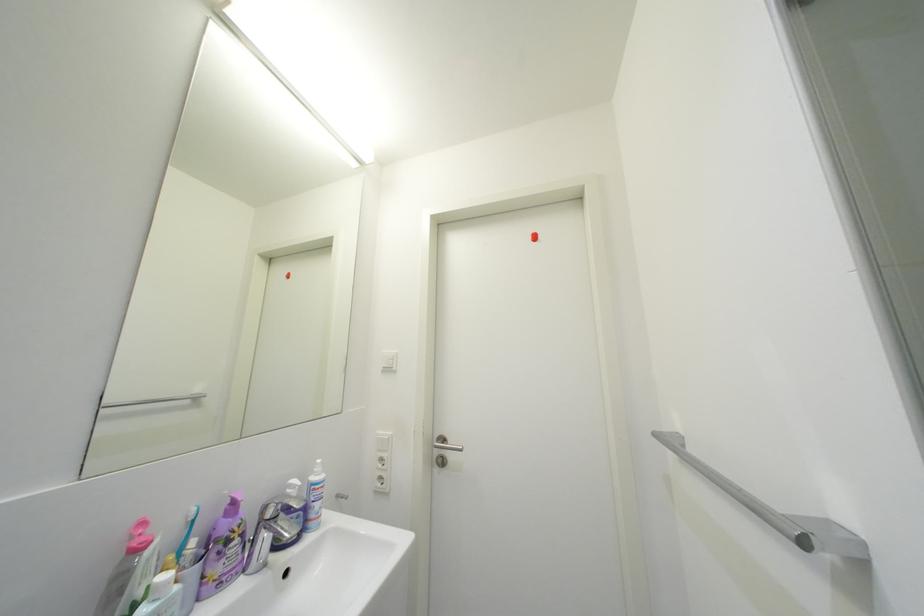
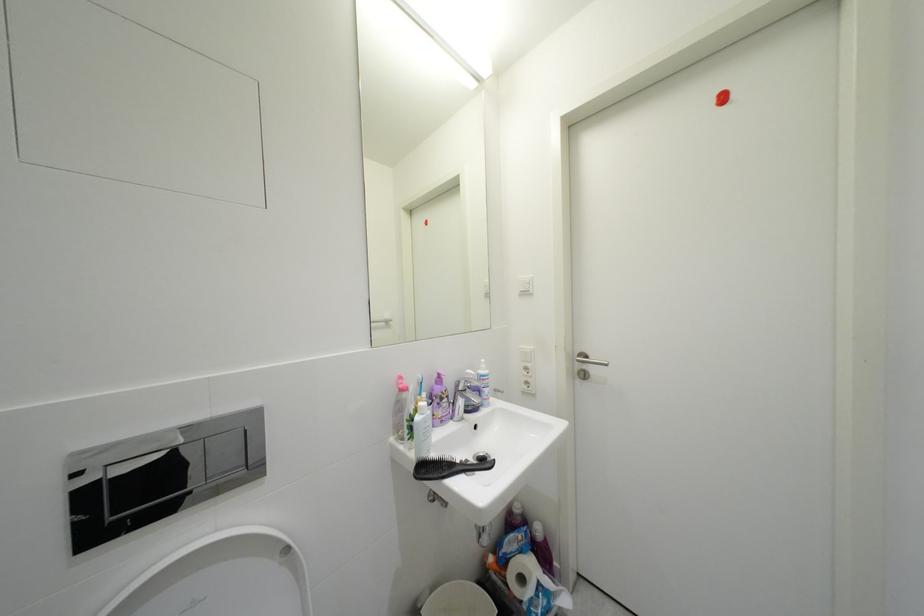
Question: The first image is from the beginning of the video and the second image is from the end. How did the camera likely rotate when shooting the video?

Choices:
 (A) Left
 (B) Right
 (C) Up
 (D) Down

Answer: (A)